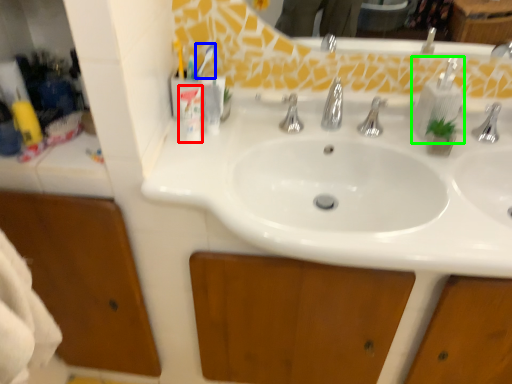
Question: Which object is positioned farthest from toiletry (highlighted by a red box)? Select from toothbrush (highlighted by a blue box) and soap dispenser (highlighted by a green box).

Choices:
 (A) toothbrush
 (B) soap dispenser

Answer: (B)